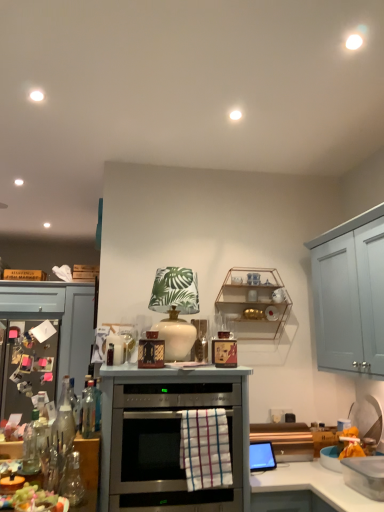
Question: From the image's perspective, is clear glass bottle at center, the first bottle when ordered from right to left, above or below white checkered towel at center?

Choices:
 (A) above
 (B) below

Answer: (A)

Question: Is clear glass bottle at center, arranged as the second bottle when viewed from the left, inside the boundaries of white checkered towel at center, or outside?

Choices:
 (A) outside
 (B) inside

Answer: (A)

Question: Estimate the real-world distances between objects in this image. Which object is closer to the white ceramic lamp at center, acting as the second appliance starting from the bottom?

Choices:
 (A) satin silver oven at center
 (B) clear glass bottle at lower left, the second bottle viewed from the right
 (C) translucent glass grapes at lower left
 (D) clear glass bottle at center, the first bottle when ordered from right to left
 (E) white checkered towel at center

Answer: (A)

Question: Estimate the real-world distances between objects in this image. Which object is closer to the white ceramic lamp at center, positioned as the first appliance in back-to-front order?

Choices:
 (A) clear plastic container at lower right, which appears as the second appliance when viewed from the top
 (B) translucent glass grapes at lower left
 (C) satin silver oven at center
 (D) clear glass bottle at lower left, the 1th bottle when ordered from left to right
 (E) clear glass bottle at center, the first bottle when ordered from right to left

Answer: (C)